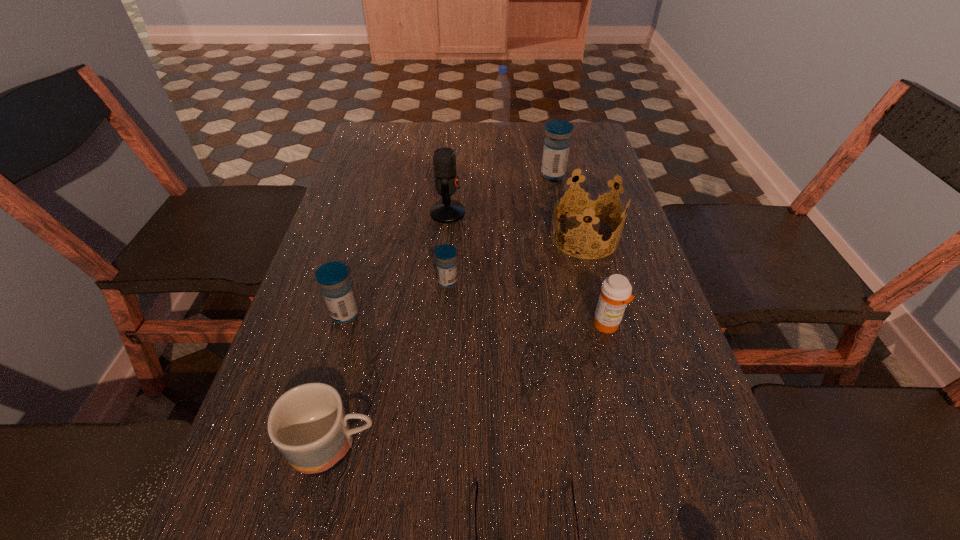
You are a GUI agent. You are given a task and a screenshot of the screen. Output one action in this format:
    pyautogui.click(x=<x>, y=<y>)
    Task: Click on the blue bottle
    
    Given the screenshot: What is the action you would take?
    pyautogui.click(x=502, y=87)

Image resolution: width=960 pixels, height=540 pixels. What are the coordinates of `bottle` in the screenshot? It's located at (502, 87).

Identify the location of red microphone. This screenshot has height=540, width=960. [446, 179].

Find the location of a particular element. the biggest blue medicine is located at coordinates (556, 148).

Image resolution: width=960 pixels, height=540 pixels. What are the coordinates of `the tallest medicine` in the screenshot? It's located at (556, 148).

I want to click on crown, so click(x=591, y=204).

Locate an element on the screen. The image size is (960, 540). the second smallest blue medicine is located at coordinates (333, 277).

Locate an element on the screen. the leftmost blue medicine is located at coordinates (333, 277).

Identify the location of orange medicine. (616, 290).

Locate an element on the screen. Image resolution: width=960 pixels, height=540 pixels. mug is located at coordinates (308, 424).